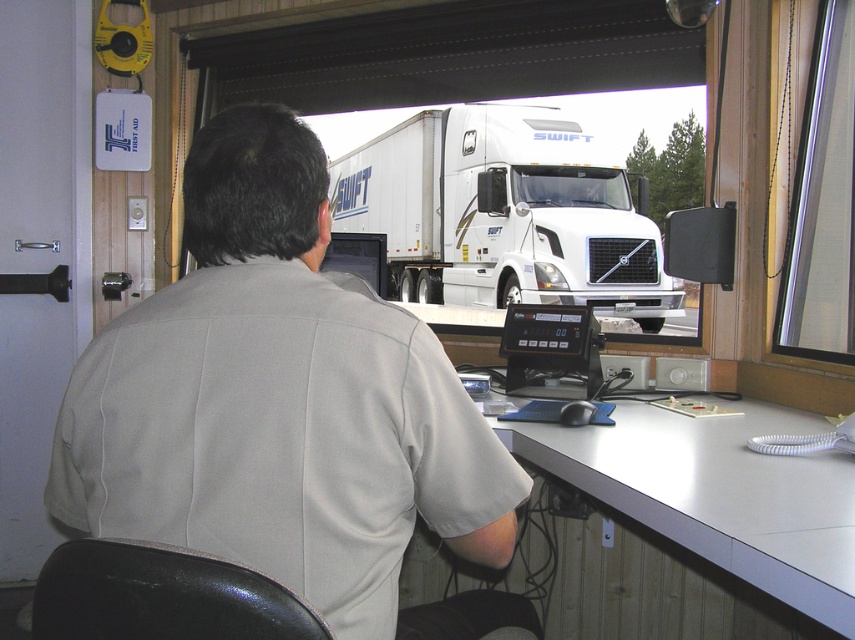
Please provide the coordinates of the gray fabric shirt at center in the image. The coordinates should be in the format of a tuple with two decimal numbers rounded to three decimal places, like this example format. Please do not add any additional text or explanation. The answer must be in the following format exactly as specified. Answer format example example example example example example example example example example example example example example example example example example example example

The coordinates of the gray fabric shirt at center are at point (284, 406).

You are a delivery driver who needs to check the height of your truck before entering a low bridge. You see the gray fabric shirt at center and the white glossy truck at center in the image. Which object in the image is taller?

The gray fabric shirt at center is not as tall as the white glossy truck at center, so the white glossy truck at center is taller.

You are a delivery driver who needs to park your truck exactly 20 feet away from the desk. Based on the scene, can you park your truck closer to the desk than the current distance between the white glossy truck at center and the white glossy computer desk at lower right?

The current distance between the white glossy truck at center and the white glossy computer desk at lower right is 17.59 feet. Since you need to park exactly 20 feet away, you can move your truck slightly further away from the desk to achieve the required distance of 20 feet.